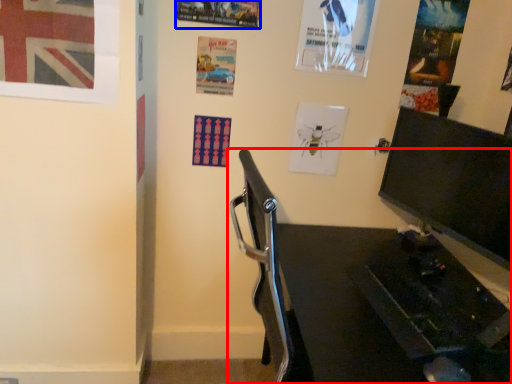
Question: Among these objects, which one is farthest to the camera, furniture (highlighted by a red box) or poster page (highlighted by a blue box)?

Choices:
 (A) furniture
 (B) poster page

Answer: (B)